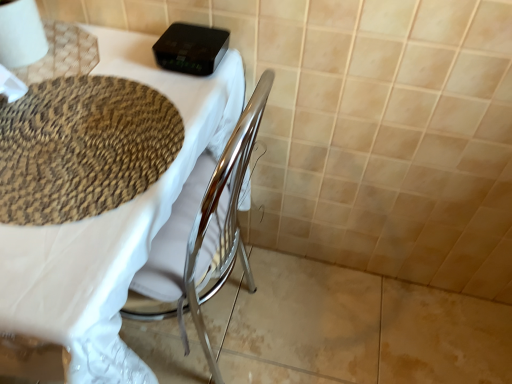
Question: Does point (214, 129) appear closer or farther from the camera than point (145, 137)?

Choices:
 (A) closer
 (B) farther

Answer: (B)

Question: Is matte woven placemat at upper left in front of or behind woven beige mat at upper left in the image?

Choices:
 (A) front
 (B) behind

Answer: (A)

Question: Based on their relative distances, which object is nearer to the matte woven placemat at upper left?

Choices:
 (A) white paper at upper left
 (B) woven beige mat at upper left

Answer: (B)

Question: Considering the real-world distances, which object is farthest from the matte woven placemat at upper left?

Choices:
 (A) white paper at upper left
 (B) woven beige mat at upper left

Answer: (A)